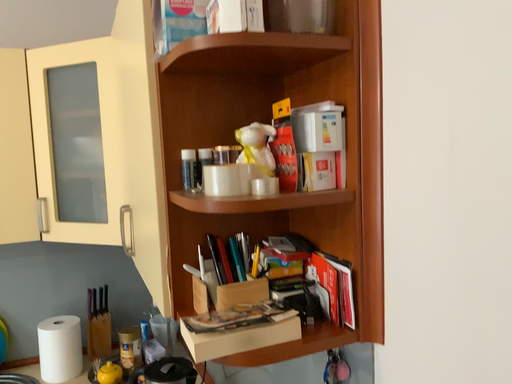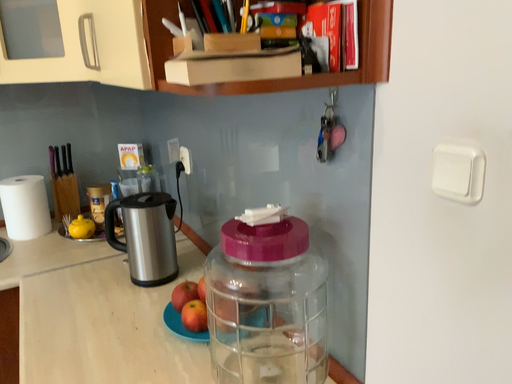
Question: Which way did the camera rotate in the video?

Choices:
 (A) rotated downward
 (B) rotated upward

Answer: (A)